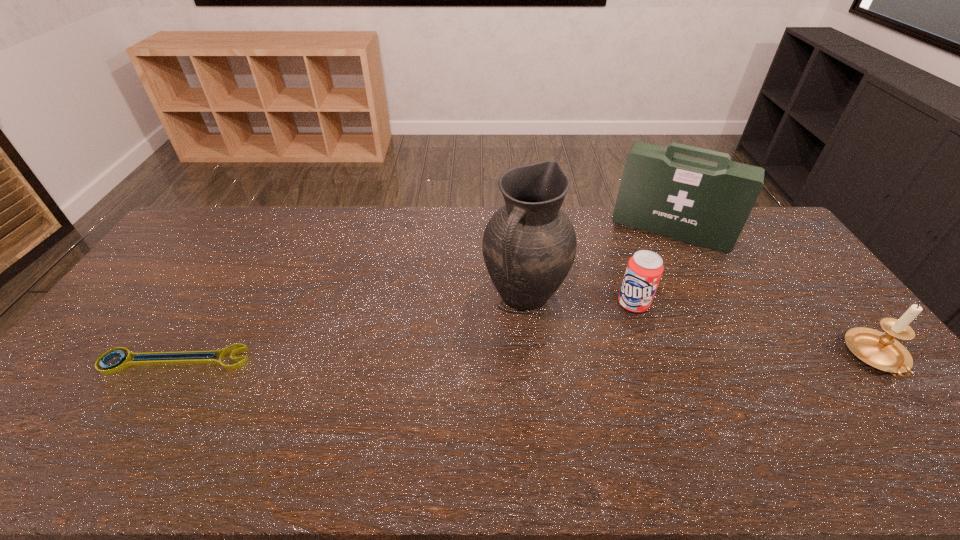
Image resolution: width=960 pixels, height=540 pixels. In order to click on vacant space in between the soda can and the leftmost object in this screenshot , I will do `click(404, 332)`.

I want to click on free space between the soda can and the rightmost object, so click(756, 330).

Identify the location of unoccupied position between the candle holder and the first-aid kit. (774, 294).

Where is `free space between the candle holder and the soda can`? The width and height of the screenshot is (960, 540). free space between the candle holder and the soda can is located at coordinates (756, 330).

Locate an element on the screen. vacant space that is in between the rightmost object and the farthest object is located at coordinates (774, 294).

Locate which object is the second closest to the second tallest object. Please provide its 2D coordinates. Your answer should be formatted as a tuple, i.e. [(x, y)], where the tuple contains the x and y coordinates of a point satisfying the conditions above.

[(529, 245)]

This screenshot has width=960, height=540. What are the coordinates of `the second closest object to the shortest object` in the screenshot? It's located at (644, 270).

Where is `vacant space that satisfies the following two spatial constraints: 1. on the back side of the wrench; 2. on the left side of the first-aid kit`? The height and width of the screenshot is (540, 960). vacant space that satisfies the following two spatial constraints: 1. on the back side of the wrench; 2. on the left side of the first-aid kit is located at coordinates (255, 230).

Locate an element on the screen. The height and width of the screenshot is (540, 960). vacant area in the image that satisfies the following two spatial constraints: 1. on the back side of the shortest object; 2. on the right side of the soda can is located at coordinates (210, 303).